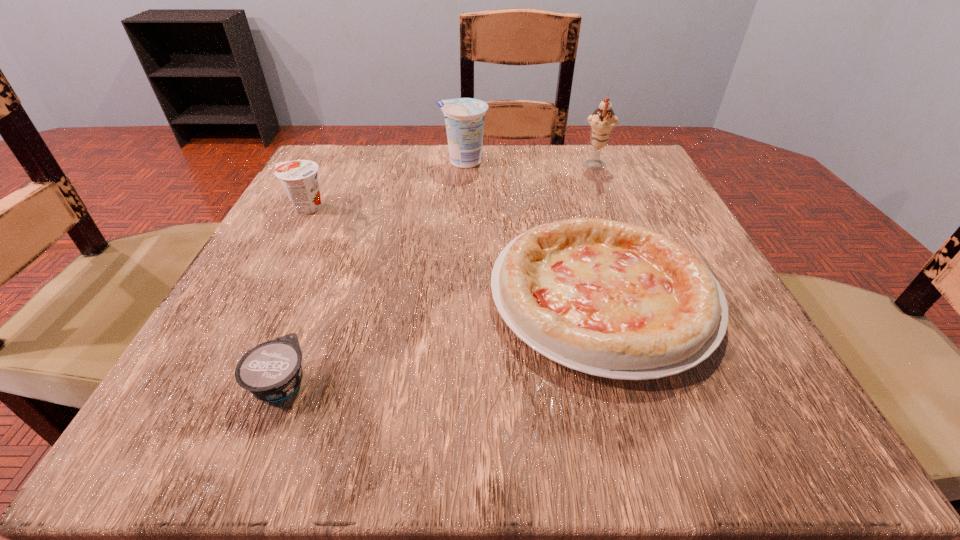
Locate an element on the screen. This screenshot has width=960, height=540. vacant space situated 0.120m on the front of the third shortest object is located at coordinates (277, 262).

The height and width of the screenshot is (540, 960). What are the coordinates of `free space located on the back of the second shortest object` in the screenshot? It's located at (563, 159).

Where is `vacant region located on the right of the second yogurt from left to right`? vacant region located on the right of the second yogurt from left to right is located at coordinates (377, 382).

Identify the location of icecream at the far edge. (602, 122).

Locate an element on the screen. This screenshot has width=960, height=540. pizza located in the near edge section of the desktop is located at coordinates (611, 299).

The width and height of the screenshot is (960, 540). What are the coordinates of `yogurt that is positioned at the near edge` in the screenshot? It's located at (271, 371).

The image size is (960, 540). What are the coordinates of `icecream at the right edge` in the screenshot? It's located at (602, 122).

Locate an element on the screen. pizza at the right edge is located at coordinates (611, 299).

Where is `object present at the far left corner`? This screenshot has height=540, width=960. object present at the far left corner is located at coordinates (299, 178).

Where is `object positioned at the near left corner`? This screenshot has height=540, width=960. object positioned at the near left corner is located at coordinates (271, 371).